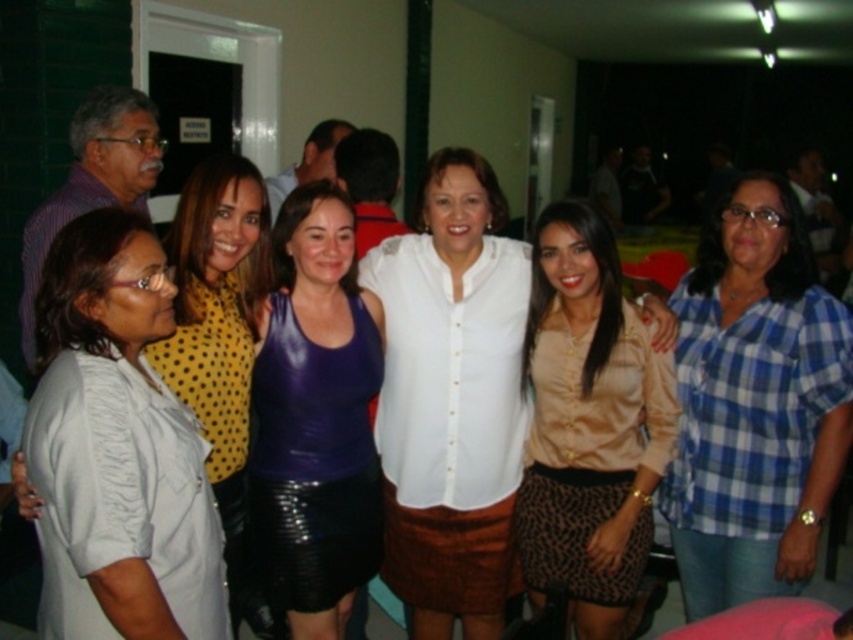
Is purple shiny tank top at center smaller than white button-up shirt at center?

Incorrect, purple shiny tank top at center is not smaller in size than white button-up shirt at center.

Is purple shiny tank top at center behind white button-up shirt at center?

→ No.

Which is behind, point (273, 344) or point (434, 378)?

The point (434, 378) is more distant.

Where is `purple shiny tank top at center`? This screenshot has width=853, height=640. purple shiny tank top at center is located at coordinates (316, 417).

Locate an element on the screen. white satin blouse at left is located at coordinates (117, 449).

Who is more forward, (175, 628) or (532, 289)?

Point (175, 628)

Where is `white satin blouse at left`? This screenshot has height=640, width=853. white satin blouse at left is located at coordinates (117, 449).

Is blue plaid shirt at right smaller than yellow dotted blouse at upper left?

Indeed, blue plaid shirt at right has a smaller size compared to yellow dotted blouse at upper left.

Can you confirm if blue plaid shirt at right is positioned to the right of yellow dotted blouse at upper left?

Correct, you'll find blue plaid shirt at right to the right of yellow dotted blouse at upper left.

Describe the element at coordinates (753, 403) in the screenshot. I see `blue plaid shirt at right` at that location.

Where is `blue plaid shirt at right`? The image size is (853, 640). blue plaid shirt at right is located at coordinates (753, 403).